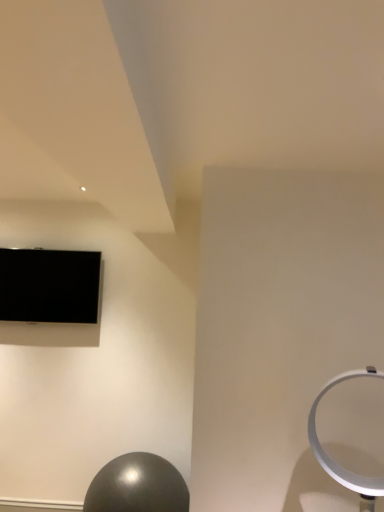
Question: Does shiny metallic ball at lower left have a greater width compared to black glossy tv at upper left?

Choices:
 (A) yes
 (B) no

Answer: (A)

Question: Does shiny metallic ball at lower left have a lesser width compared to black glossy tv at upper left?

Choices:
 (A) no
 (B) yes

Answer: (A)

Question: Can you confirm if shiny metallic ball at lower left is positioned to the right of black glossy tv at upper left?

Choices:
 (A) yes
 (B) no

Answer: (A)

Question: Is shiny metallic ball at lower left far away from black glossy tv at upper left?

Choices:
 (A) yes
 (B) no

Answer: (A)

Question: From a real-world perspective, is shiny metallic ball at lower left located higher than black glossy tv at upper left?

Choices:
 (A) no
 (B) yes

Answer: (A)

Question: Does shiny metallic ball at lower left lie in front of black glossy tv at upper left?

Choices:
 (A) no
 (B) yes

Answer: (B)

Question: Considering the relative sizes of black glossy tv at upper left and shiny metallic ball at lower left in the image provided, is black glossy tv at upper left smaller than shiny metallic ball at lower left?

Choices:
 (A) yes
 (B) no

Answer: (A)

Question: Considering the relative sizes of black glossy tv at upper left and shiny metallic ball at lower left in the image provided, is black glossy tv at upper left taller than shiny metallic ball at lower left?

Choices:
 (A) yes
 (B) no

Answer: (A)

Question: From a real-world perspective, is black glossy tv at upper left physically below shiny metallic ball at lower left?

Choices:
 (A) no
 (B) yes

Answer: (A)

Question: Can you confirm if black glossy tv at upper left is positioned to the left of shiny metallic ball at lower left?

Choices:
 (A) yes
 (B) no

Answer: (A)

Question: Does black glossy tv at upper left have a lesser height compared to shiny metallic ball at lower left?

Choices:
 (A) yes
 (B) no

Answer: (B)

Question: Is black glossy tv at upper left positioned beyond the bounds of shiny metallic ball at lower left?

Choices:
 (A) yes
 (B) no

Answer: (A)

Question: Is shiny metallic ball at lower left taller or shorter than black glossy tv at upper left?

Choices:
 (A) short
 (B) tall

Answer: (A)